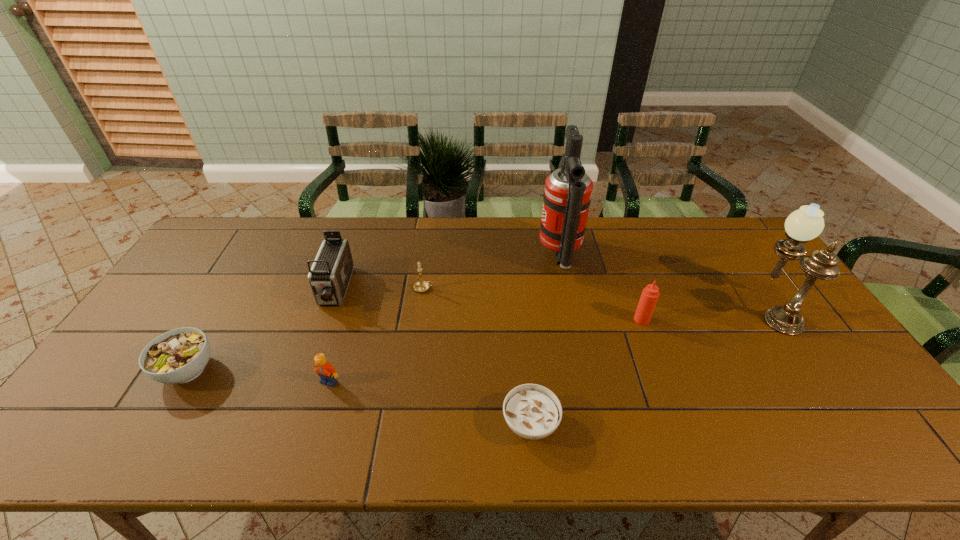
Locate an element on the screen. vacant area in the image that satisfies the following two spatial constraints: 1. on the front-facing side of the Lego; 2. on the right side of the nearer soup bowl is located at coordinates (317, 423).

At what (x,y) coordinates should I click in order to perform the action: click on vacant space that satisfies the following two spatial constraints: 1. on the handle side of the candle holder; 2. on the back side of the second object from right to left. Please return your answer as a coordinate pair (x, y). The width and height of the screenshot is (960, 540). Looking at the image, I should click on (420, 320).

What are the coordinates of `free space that satisfies the following two spatial constraints: 1. on the front-facing side of the fourth object from right to left; 2. on the left side of the Lego` in the screenshot? It's located at (317, 423).